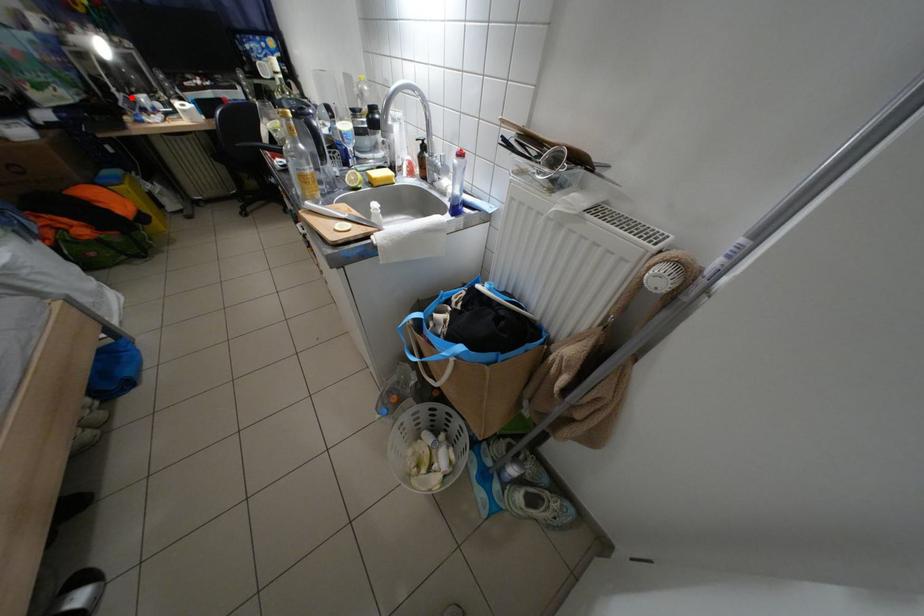
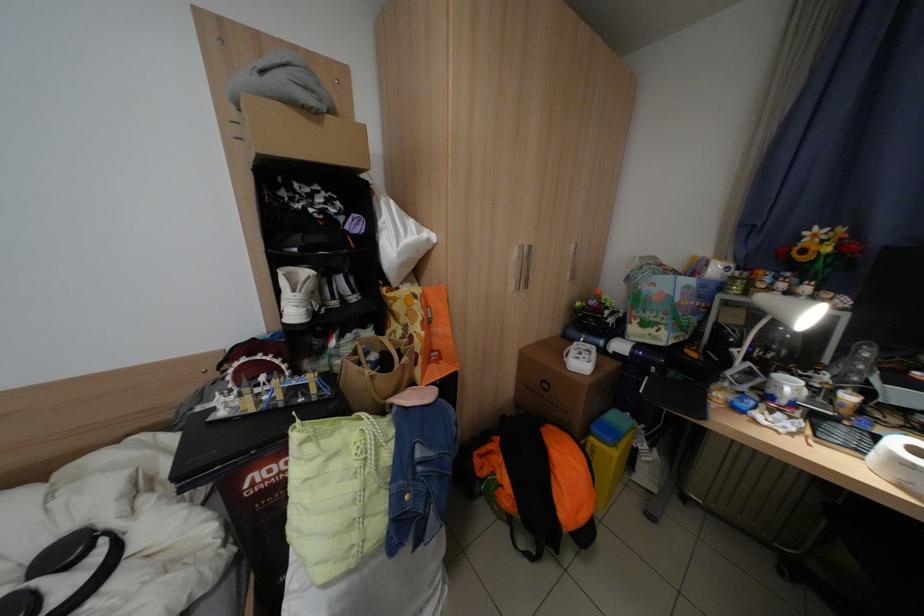
Question: I am providing you with two images of the same scene from different viewpoints. Image1 has a red point marked. In image2, the corresponding 3D location appears at what relative position? Reply with the corresponding letter.

Choices:
 (A) Closer
 (B) Farther

Answer: (A)